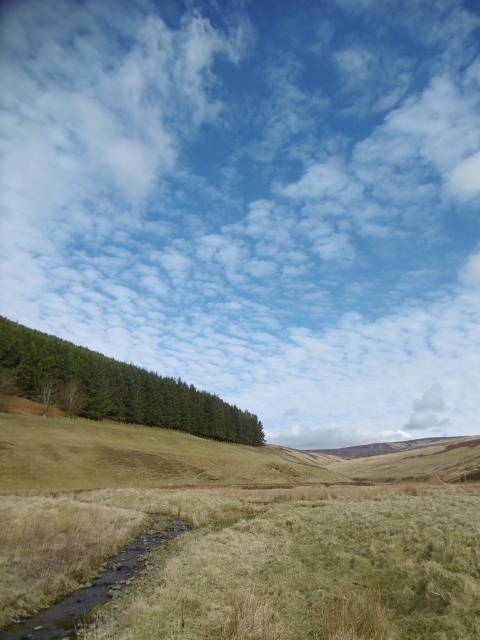
Question: Which point is farther to the camera?

Choices:
 (A) white fluffy cloud at upper center
 (B) brown grassy stream at lower left

Answer: (A)

Question: Which of these objects is positioned closest to the white fluffy cloud at upper center?

Choices:
 (A) green matte forest at left
 (B) brown grassy stream at lower left

Answer: (A)

Question: Which point is farther to the camera?

Choices:
 (A) (15, 364)
 (B) (82, 253)

Answer: (B)

Question: Where is green matte forest at left located in relation to brown grassy stream at lower left in the image?

Choices:
 (A) right
 (B) left

Answer: (B)

Question: Can you confirm if green matte forest at left is bigger than brown grassy stream at lower left?

Choices:
 (A) no
 (B) yes

Answer: (B)

Question: Is the position of white fluffy cloud at upper center more distant than that of brown grassy stream at lower left?

Choices:
 (A) yes
 (B) no

Answer: (A)